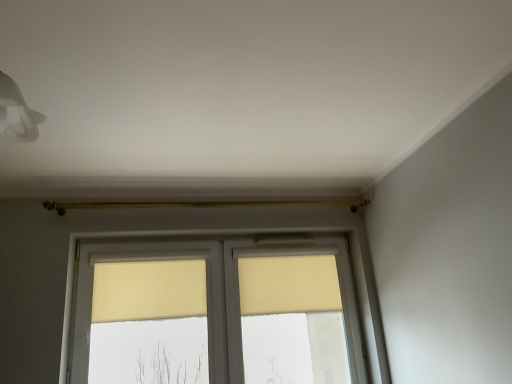
Question: Is beige fabric curtain at center, the first curtain when ordered from left to right, next to beige fabric curtain at center, the first curtain when ordered from right to left, and touching it?

Choices:
 (A) yes
 (B) no

Answer: (B)

Question: Can you confirm if beige fabric curtain at center, acting as the 2th curtain starting from the right, is shorter than beige fabric curtain at center, the first curtain when ordered from right to left?

Choices:
 (A) yes
 (B) no

Answer: (A)

Question: Is beige fabric curtain at center, the first curtain when ordered from left to right, positioned with its back to beige fabric curtain at center, the second curtain from the left?

Choices:
 (A) yes
 (B) no

Answer: (B)

Question: Can you confirm if beige fabric curtain at center, acting as the 2th curtain starting from the right, is thinner than beige fabric curtain at center, the first curtain when ordered from right to left?

Choices:
 (A) no
 (B) yes

Answer: (A)

Question: Is beige fabric curtain at center, acting as the 2th curtain starting from the right, oriented towards beige fabric curtain at center, the first curtain when ordered from right to left?

Choices:
 (A) yes
 (B) no

Answer: (B)

Question: Is beige fabric curtain at center, the first curtain when ordered from left to right, positioned before beige fabric curtain at center, the second curtain from the left?

Choices:
 (A) yes
 (B) no

Answer: (A)

Question: Could you tell me if beige fabric curtain at center, the second curtain from the left, is facing matte yellow window at center?

Choices:
 (A) yes
 (B) no

Answer: (A)

Question: From the image's perspective, is beige fabric curtain at center, the first curtain when ordered from right to left, over matte yellow window at center?

Choices:
 (A) no
 (B) yes

Answer: (B)

Question: Is beige fabric curtain at center, the second curtain from the left, to the left of matte yellow window at center from the viewer's perspective?

Choices:
 (A) yes
 (B) no

Answer: (B)

Question: From a real-world perspective, is beige fabric curtain at center, the first curtain when ordered from right to left, positioned under matte yellow window at center based on gravity?

Choices:
 (A) yes
 (B) no

Answer: (B)

Question: Considering the relative positions of beige fabric curtain at center, the first curtain when ordered from right to left, and matte yellow window at center in the image provided, is beige fabric curtain at center, the first curtain when ordered from right to left, to the right of matte yellow window at center from the viewer's perspective?

Choices:
 (A) yes
 (B) no

Answer: (A)

Question: Considering the relative sizes of beige fabric curtain at center, the second curtain from the left, and matte yellow window at center in the image provided, is beige fabric curtain at center, the second curtain from the left, smaller than matte yellow window at center?

Choices:
 (A) yes
 (B) no

Answer: (A)

Question: From a real-world perspective, does matte yellow window at center sit lower than beige fabric curtain at center, the second curtain from the left?

Choices:
 (A) yes
 (B) no

Answer: (A)